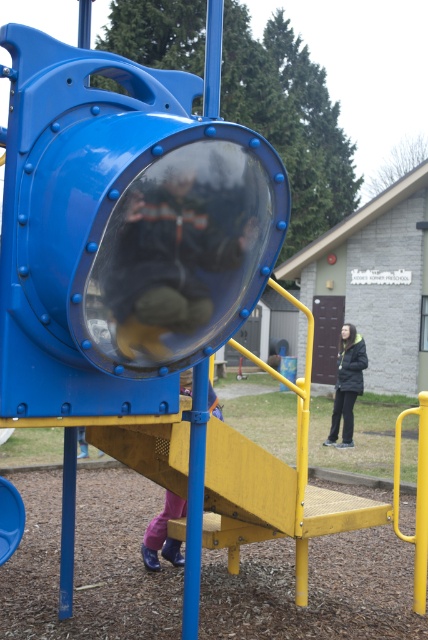
You are a parent trying to locate your child in the playground. You see two children wearing jackets. One is wearing a dark blue jacket at center and the other a dark gray jacket at right. Which child appears smaller in the image?

The dark blue jacket at center occupies less space than the dark gray jacket at right, so the child wearing the dark blue jacket at center appears smaller in the image.